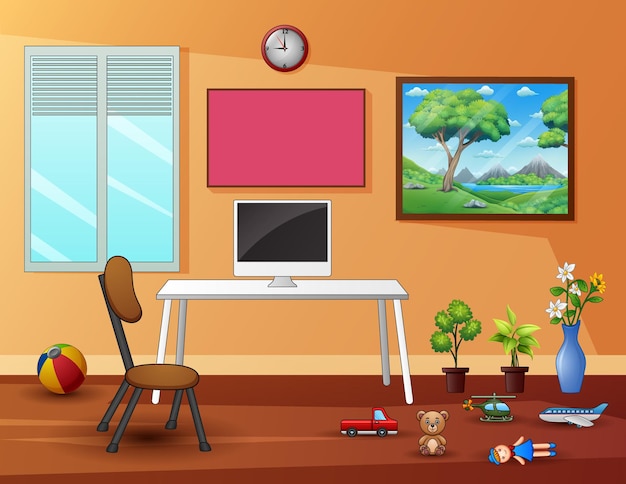
At what (x,y) coordinates should I click in order to perform the action: click on blue vase. Please return your answer as a coordinate pair (x, y). The height and width of the screenshot is (484, 626). Looking at the image, I should click on (571, 368).